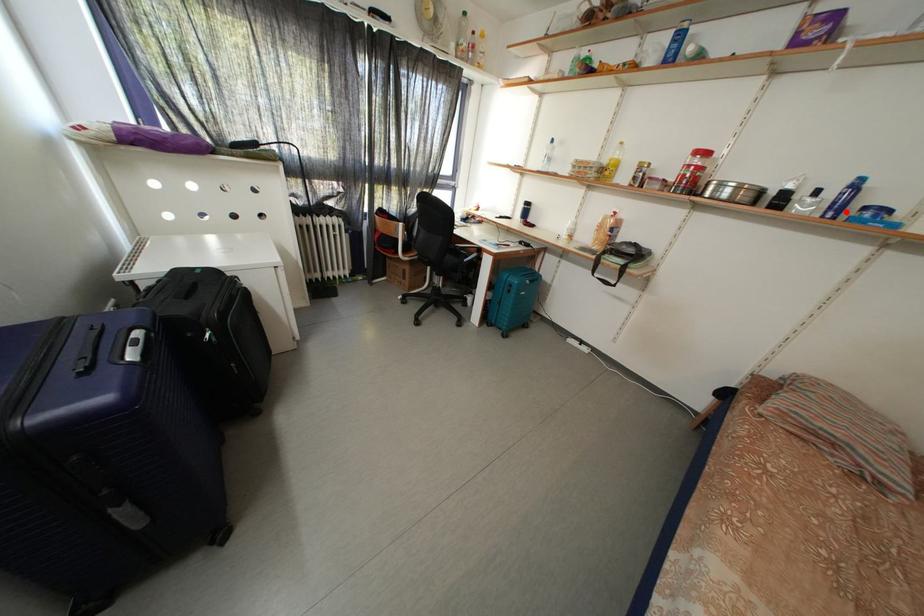
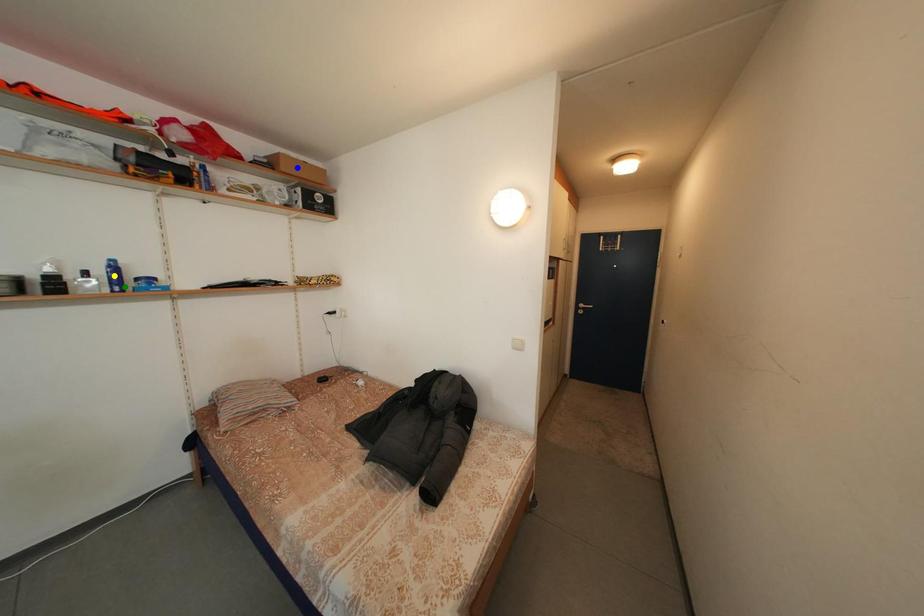
Question: I am providing you with two images of the same scene from different viewpoints. A red point is marked on the first image. You are given multiple points on the second image. Which point in image 2 is actually the same real-world point as the red point in image 1?

Choices:
 (A) blue point
 (B) yellow point
 (C) green point

Answer: (C)